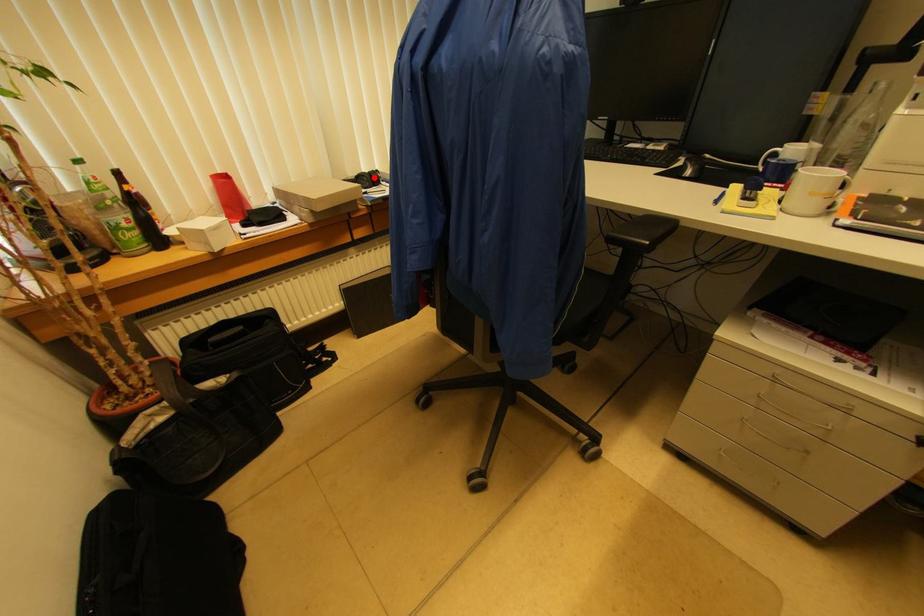
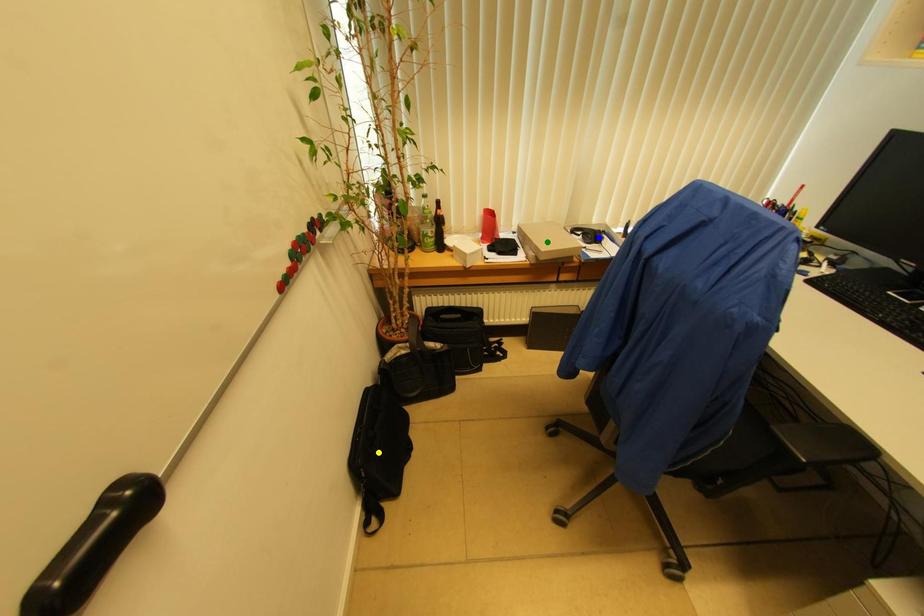
Question: I am providing you with two images of the same scene from different viewpoints. A red point is marked on the first image. You are given multiple points on the second image. Which point in image 2 is actually the same real-world point as the red point in image 1?

Choices:
 (A) yellow point
 (B) blue point
 (C) green point

Answer: (B)